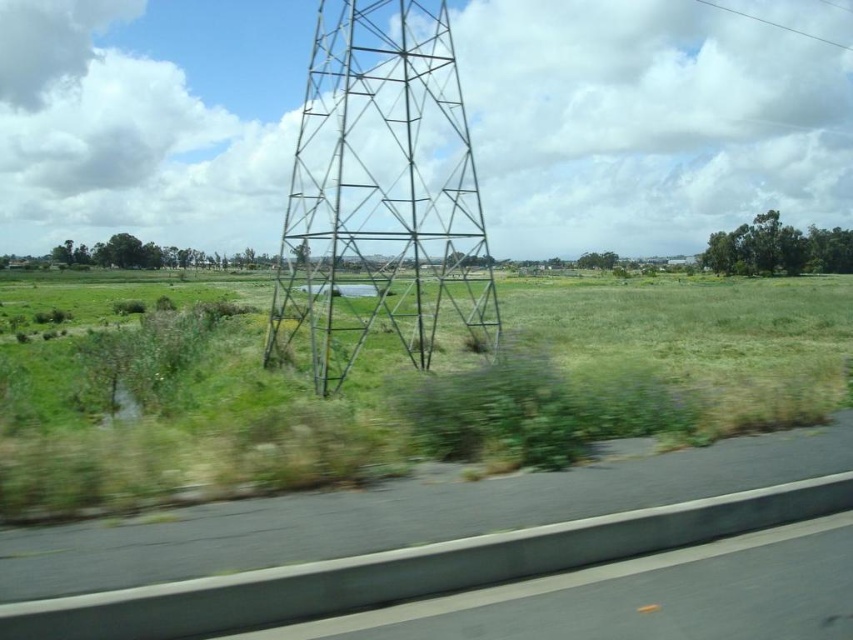
You are a photographer trying to capture the metallic grid tower at center and the clear wire at upper right in the same frame. Based on their positions, which object will appear larger in your photo?

Answer: The metallic grid tower at center appears larger in the photo because it is closer to the viewer than the clear wire at upper right.